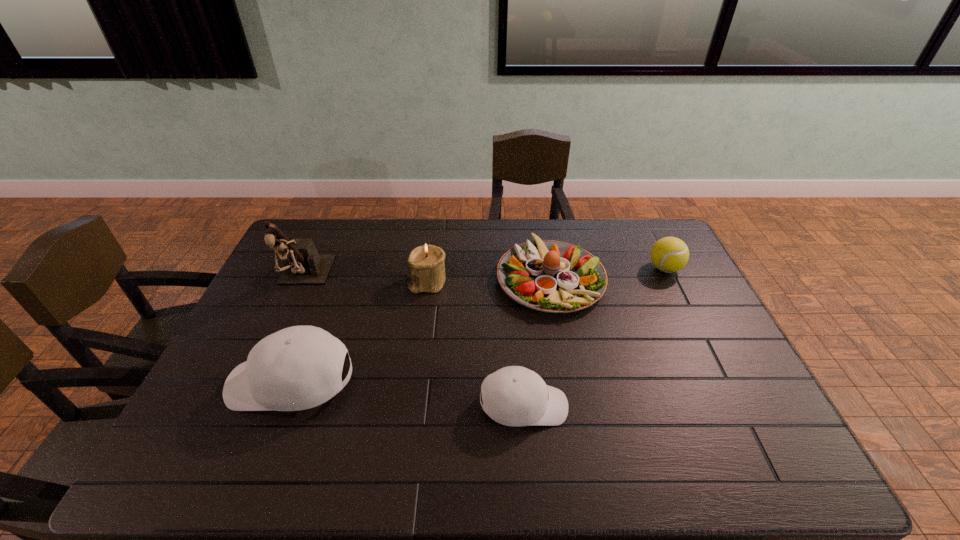
Locate an element on the screen. This screenshot has width=960, height=540. the taller baseball cap is located at coordinates (300, 367).

The height and width of the screenshot is (540, 960). In order to click on the shorter baseball cap in this screenshot , I will do `click(516, 396)`.

Find the location of `salad plate`. salad plate is located at coordinates click(551, 276).

I want to click on figurine, so click(x=303, y=265).

Identify the location of the fourth object from right to left. The image size is (960, 540). (426, 265).

I want to click on tennis ball, so click(x=669, y=254).

This screenshot has height=540, width=960. Identify the location of vacant space located on the front-facing side of the shorter baseball cap. (707, 406).

I want to click on vacant space located 0.090m on the front of the salad plate, so click(x=562, y=342).

This screenshot has width=960, height=540. In order to click on vacant space located on the front-facing side of the figurine in this screenshot , I will do `click(279, 332)`.

Where is `free space located on the right of the candle_holder`? free space located on the right of the candle_holder is located at coordinates (471, 282).